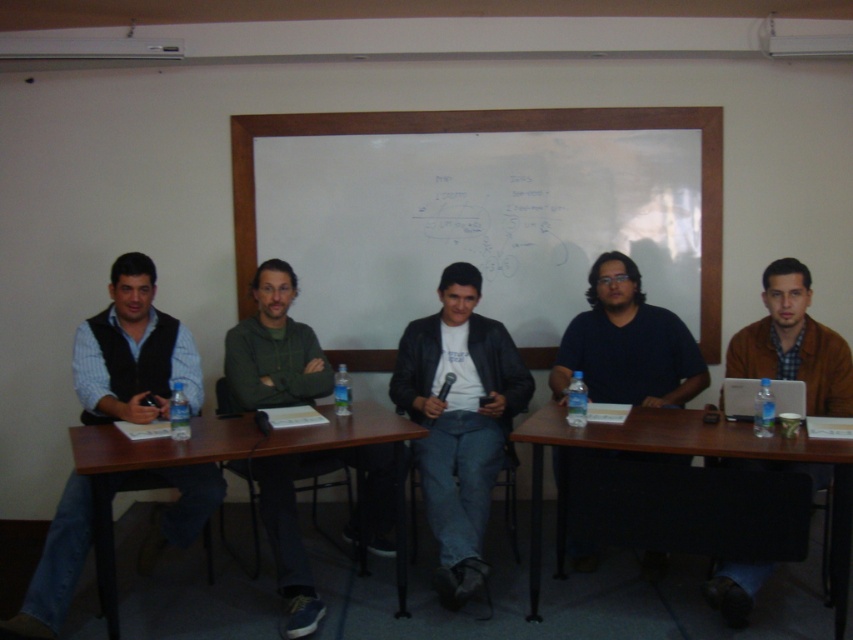
Is dark blue shirt at center taller than brown wooden table at center?

Incorrect, dark blue shirt at center's height is not larger of brown wooden table at center's.

Which is behind, point (585, 321) or point (108, 467)?

The point (585, 321) is more distant.

This screenshot has height=640, width=853. I want to click on dark blue shirt at center, so click(627, 342).

I want to click on matte black vest at left, so click(x=132, y=353).

How distant is matte black vest at left from white matte board at center?

matte black vest at left is 1.55 meters from white matte board at center.

At what (x,y) coordinates should I click in order to perform the action: click on matte black vest at left. Please return your answer as a coordinate pair (x, y). Looking at the image, I should click on (132, 353).

Locate an element on the screen. The width and height of the screenshot is (853, 640). matte black vest at left is located at coordinates tap(132, 353).

Is black leather jacket at center taller than whiteboard at center?

Yes.

Looking at this image, can you confirm if black leather jacket at center is shorter than whiteboard at center?

Incorrect, black leather jacket at center's height does not fall short of whiteboard at center's.

Locate an element on the screen. This screenshot has height=640, width=853. black leather jacket at center is located at coordinates (459, 420).